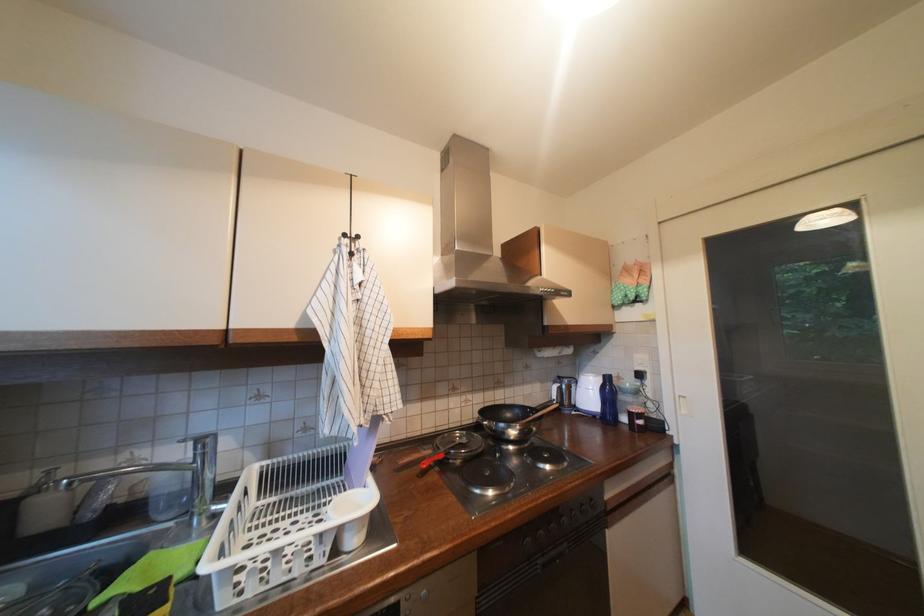
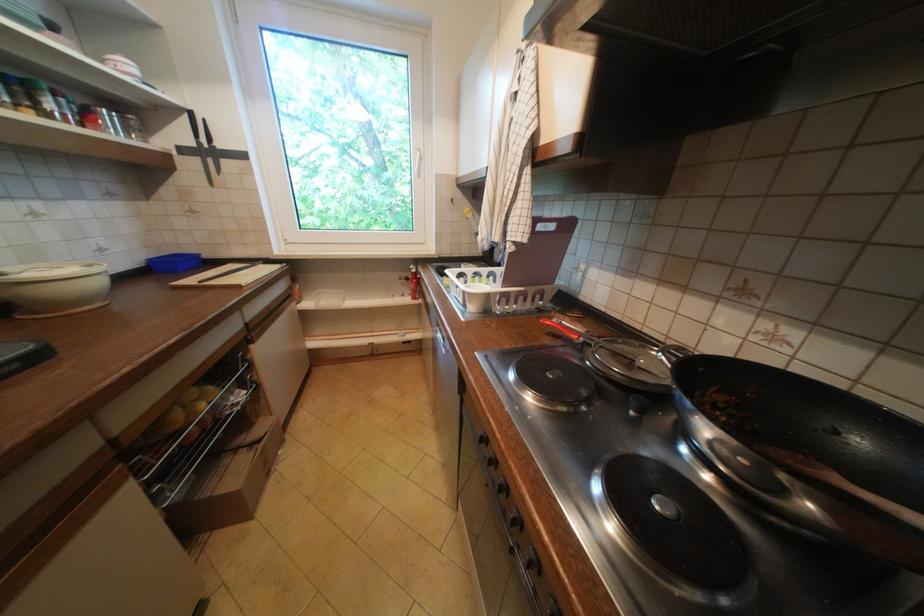
Find the pixel in the second image that matches the point at 429,477 in the first image.

(558, 334)